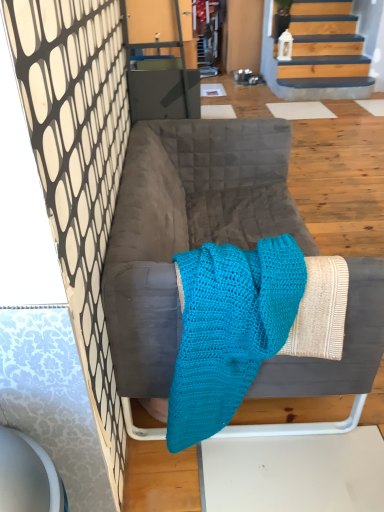
Locate an element on the screen. velvet gray sofa at center is located at coordinates (186, 228).

This screenshot has height=512, width=384. What do you see at coordinates (186, 228) in the screenshot?
I see `velvet gray sofa at center` at bounding box center [186, 228].

The height and width of the screenshot is (512, 384). I want to click on turquoise knitted blanket at center, so click(x=229, y=329).

The height and width of the screenshot is (512, 384). Describe the element at coordinates (229, 329) in the screenshot. I see `turquoise knitted blanket at center` at that location.

I want to click on velvet gray sofa at center, so click(x=186, y=228).

Considering the positions of objects turquoise knitted blanket at center and velvet gray sofa at center in the image provided, who is more to the right, turquoise knitted blanket at center or velvet gray sofa at center?

From the viewer's perspective, velvet gray sofa at center appears more on the right side.

Between turquoise knitted blanket at center and velvet gray sofa at center, which one is positioned in front?

turquoise knitted blanket at center is in front.

Which is in front, point (238, 306) or point (112, 226)?

The point (238, 306) is closer.

From the image's perspective, who appears lower, turquoise knitted blanket at center or velvet gray sofa at center?

turquoise knitted blanket at center is shown below in the image.

From a real-world perspective, between turquoise knitted blanket at center and velvet gray sofa at center, who is vertically lower?

velvet gray sofa at center.

Which object is wider, turquoise knitted blanket at center or velvet gray sofa at center?

Wider between the two is velvet gray sofa at center.

Does turquoise knitted blanket at center have a greater height compared to velvet gray sofa at center?

No, turquoise knitted blanket at center is not taller than velvet gray sofa at center.

Can you confirm if turquoise knitted blanket at center is smaller than velvet gray sofa at center?

Indeed, turquoise knitted blanket at center has a smaller size compared to velvet gray sofa at center.

Is turquoise knitted blanket at center located outside velvet gray sofa at center?

No, turquoise knitted blanket at center is inside or overlapping with velvet gray sofa at center.

Are turquoise knitted blanket at center and velvet gray sofa at center beside each other?

turquoise knitted blanket at center and velvet gray sofa at center are clearly separated.

Is turquoise knitted blanket at center aimed at velvet gray sofa at center?

Yes, turquoise knitted blanket at center faces towards velvet gray sofa at center.

How distant is turquoise knitted blanket at center from velvet gray sofa at center?

turquoise knitted blanket at center and velvet gray sofa at center are 14.94 inches apart.

Locate an element on the screen. The width and height of the screenshot is (384, 512). cloth located in front of the velvet gray sofa at center is located at coordinates (229, 329).

Considering the positions of objects velvet gray sofa at center and turquoise knitted blanket at center in the image provided, who is more to the left, velvet gray sofa at center or turquoise knitted blanket at center?

From the viewer's perspective, turquoise knitted blanket at center appears more on the left side.

Which is behind, velvet gray sofa at center or turquoise knitted blanket at center?

velvet gray sofa at center is further from the camera.

Considering the points (188, 231) and (287, 250), which point is behind, point (188, 231) or point (287, 250)?

The point (188, 231) is farther.

From the image's perspective, between velvet gray sofa at center and turquoise knitted blanket at center, which one is located above?

velvet gray sofa at center appears higher in the image.

From a real-world perspective, is velvet gray sofa at center physically located above or below turquoise knitted blanket at center?

Clearly, from a real-world perspective, velvet gray sofa at center is below turquoise knitted blanket at center.

Is velvet gray sofa at center thinner than turquoise knitted blanket at center?

No.

Considering the sizes of objects velvet gray sofa at center and turquoise knitted blanket at center in the image provided, who is shorter, velvet gray sofa at center or turquoise knitted blanket at center?

With less height is turquoise knitted blanket at center.

Who is smaller, velvet gray sofa at center or turquoise knitted blanket at center?

With smaller size is turquoise knitted blanket at center.

Is velvet gray sofa at center not within turquoise knitted blanket at center?

Yes, velvet gray sofa at center is not within turquoise knitted blanket at center.

Are velvet gray sofa at center and turquoise knitted blanket at center far apart?

No, velvet gray sofa at center is in close proximity to turquoise knitted blanket at center.

Is velvet gray sofa at center oriented away from turquoise knitted blanket at center?

No, velvet gray sofa at center is not facing away from turquoise knitted blanket at center.

Measure the distance between velvet gray sofa at center and turquoise knitted blanket at center.

The distance of velvet gray sofa at center from turquoise knitted blanket at center is 14.94 inches.

At what (x,y) coordinates should I click in order to perform the action: click on furniture to the right of turquoise knitted blanket at center. Please return your answer as a coordinate pair (x, y). Looking at the image, I should click on (186, 228).

The height and width of the screenshot is (512, 384). I want to click on cloth in front of the velvet gray sofa at center, so click(x=229, y=329).

Image resolution: width=384 pixels, height=512 pixels. I want to click on cloth located above the velvet gray sofa at center (from a real-world perspective), so click(x=229, y=329).